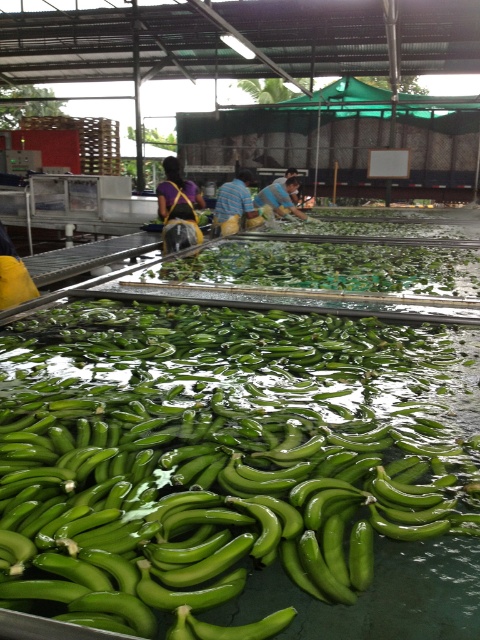
Between green rubbery bananas at center and blue striped shirt at center, which one has more height?

blue striped shirt at center is taller.

What are the coordinates of `green rubbery bananas at center` in the screenshot? It's located at (330, 266).

Who is more distant from viewer, (x=182, y=268) or (x=267, y=192)?

The point (x=267, y=192) is more distant.

The width and height of the screenshot is (480, 640). I want to click on green rubbery bananas at center, so click(330, 266).

Does point (226, 212) come closer to viewer compared to point (274, 195)?

Yes, point (226, 212) is in front of point (274, 195).

The height and width of the screenshot is (640, 480). What are the coordinates of `striped shirt at center` in the screenshot? It's located at (235, 205).

Does green rubber bananas at center appear over striped shirt at center?

Incorrect, green rubber bananas at center is not positioned above striped shirt at center.

Which is below, green rubber bananas at center or striped shirt at center?

green rubber bananas at center is lower down.

Identify the location of green rubber bananas at center. (202, 509).